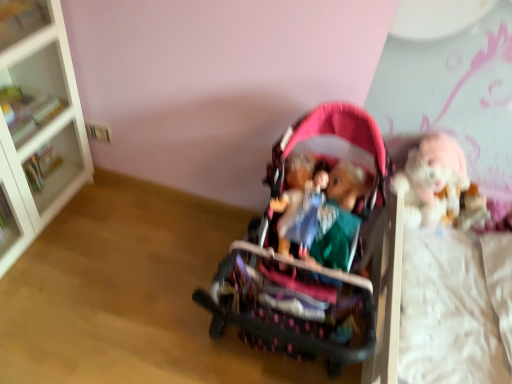
Question: Does fluffy white doll at right have a greater width compared to pink fabric stroller at center?

Choices:
 (A) no
 (B) yes

Answer: (A)

Question: Can you confirm if fluffy white doll at right is taller than pink fabric stroller at center?

Choices:
 (A) yes
 (B) no

Answer: (B)

Question: Is fluffy white doll at right positioned beyond the bounds of pink fabric stroller at center?

Choices:
 (A) no
 (B) yes

Answer: (B)

Question: Is fluffy white doll at right beside pink fabric stroller at center?

Choices:
 (A) yes
 (B) no

Answer: (B)

Question: Can you confirm if fluffy white doll at right is bigger than pink fabric stroller at center?

Choices:
 (A) yes
 (B) no

Answer: (B)

Question: From the image's perspective, is fluffy white doll at right above pink fabric stroller at center?

Choices:
 (A) yes
 (B) no

Answer: (A)

Question: From the image's perspective, would you say white glass bookcase at left is shown under fluffy white doll at right?

Choices:
 (A) yes
 (B) no

Answer: (B)

Question: From a real-world perspective, is white glass bookcase at left beneath fluffy white doll at right?

Choices:
 (A) yes
 (B) no

Answer: (A)

Question: Is white glass bookcase at left positioned with its back to fluffy white doll at right?

Choices:
 (A) no
 (B) yes

Answer: (A)

Question: Is white glass bookcase at left taller than fluffy white doll at right?

Choices:
 (A) yes
 (B) no

Answer: (A)

Question: Are white glass bookcase at left and fluffy white doll at right located far from each other?

Choices:
 (A) no
 (B) yes

Answer: (B)

Question: Would you say fluffy white doll at right is part of white glass bookcase at left's contents?

Choices:
 (A) no
 (B) yes

Answer: (A)

Question: Considering the relative sizes of matte plastic doll at center and pink fabric stroller at center in the image provided, is matte plastic doll at center taller than pink fabric stroller at center?

Choices:
 (A) yes
 (B) no

Answer: (B)